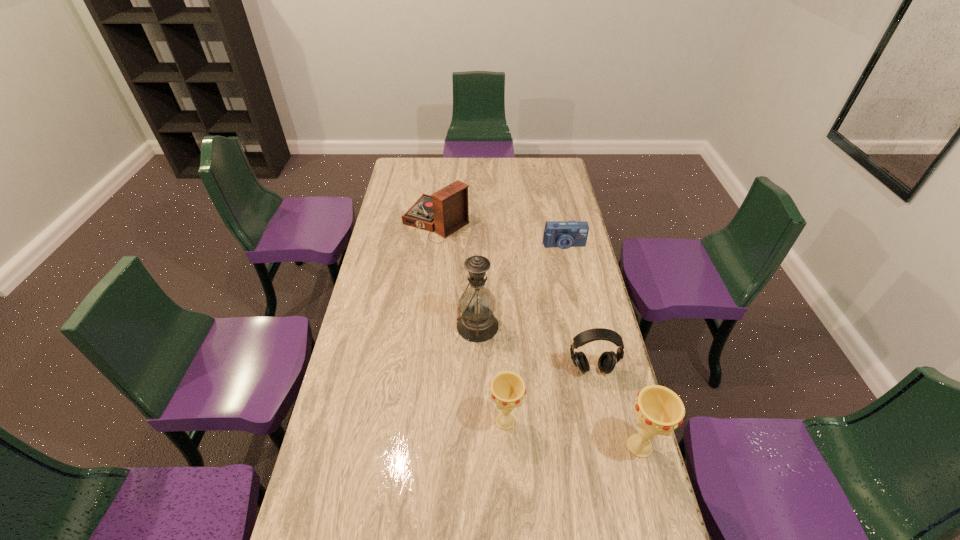
You are a GUI agent. You are given a task and a screenshot of the screen. Output one action in this format:
    pyautogui.click(x=<x>, y=<y>)
    Task: Click on the vacant space in between the shorter chalice and the fourth nearest object
    This screenshot has height=540, width=960.
    Given the screenshot: What is the action you would take?
    pyautogui.click(x=492, y=373)

This screenshot has height=540, width=960. What are the coordinates of `free space between the earphone and the shorter chalice` in the screenshot? It's located at (548, 395).

Locate an element on the screen. Image resolution: width=960 pixels, height=540 pixels. free spot between the taller chalice and the left chalice is located at coordinates (572, 434).

Where is `free space between the shortest object and the third nearest object`? The image size is (960, 540). free space between the shortest object and the third nearest object is located at coordinates (577, 307).

Find the location of `vacant region between the taller chalice and the earphone`. vacant region between the taller chalice and the earphone is located at coordinates (615, 408).

I want to click on free space between the shorter chalice and the camera, so click(x=535, y=333).

Where is `vacant space in between the phonograph record and the fourth nearest object`? This screenshot has width=960, height=540. vacant space in between the phonograph record and the fourth nearest object is located at coordinates (457, 273).

Identify the location of object that ranks as the closest to the shorter chalice. This screenshot has height=540, width=960. (607, 361).

Choose which object is the fourth nearest neighbor to the earphone. Please provide its 2D coordinates. Your answer should be formatted as a tuple, i.e. [(x, y)], where the tuple contains the x and y coordinates of a point satisfying the conditions above.

[(564, 234)]

Locate an element on the screen. free region that satisfies the following two spatial constraints: 1. on the front side of the taller chalice; 2. on the left side of the third farthest object is located at coordinates (477, 446).